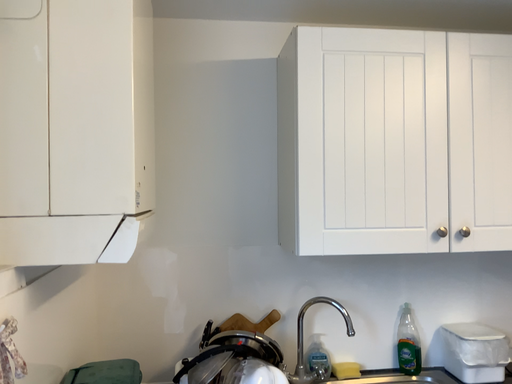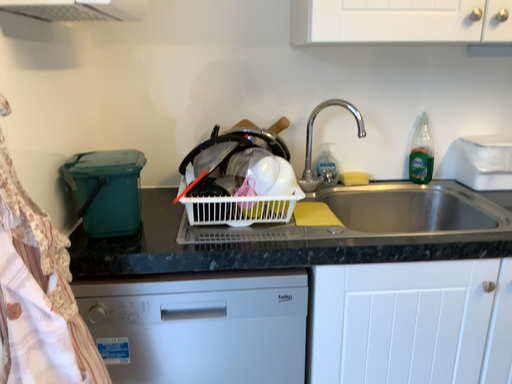
Question: Which way did the camera rotate in the video?

Choices:
 (A) rotated upward
 (B) rotated downward

Answer: (B)